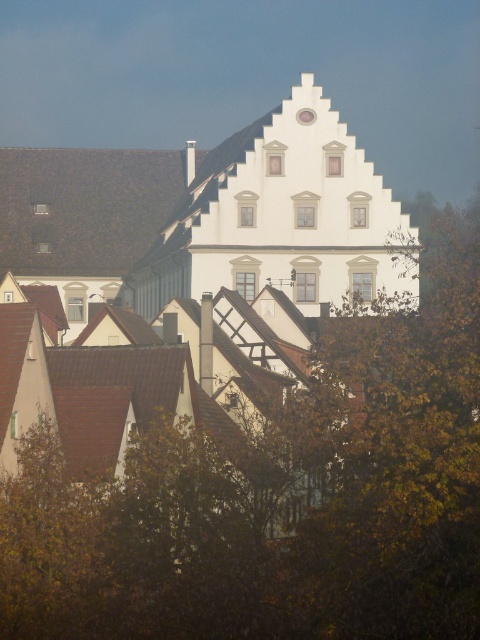
Question: Among these points, which one is nearest to the camera?

Choices:
 (A) (305, 116)
 (B) (351, 538)

Answer: (B)

Question: Which point is closer to the camera taking this photo?

Choices:
 (A) (373, 380)
 (B) (301, 115)

Answer: (A)

Question: Is brown leafy tree at upper center above white glossy clock at upper center?

Choices:
 (A) yes
 (B) no

Answer: (B)

Question: Is brown leafy tree at upper center to the left of white glossy clock at upper center from the viewer's perspective?

Choices:
 (A) no
 (B) yes

Answer: (A)

Question: Among these points, which one is nearest to the camera?

Choices:
 (A) (354, 541)
 (B) (313, 113)

Answer: (A)

Question: Does brown leafy tree at upper center have a smaller size compared to white glossy clock at upper center?

Choices:
 (A) yes
 (B) no

Answer: (B)